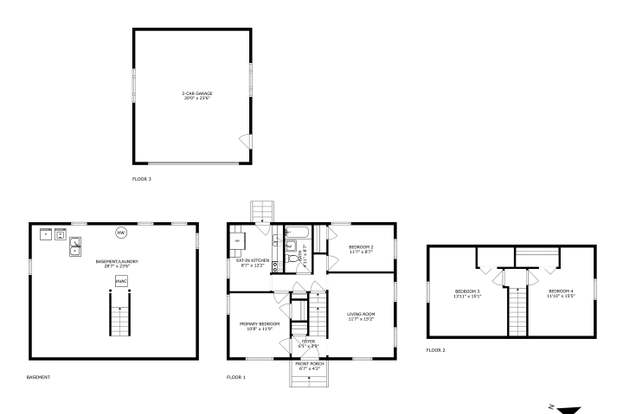
You are a GUI agent. You are given a task and a screenshot of the screen. Output one action in this format:
    pyautogui.click(x=<x>, y=<y>)
    Task: Click on the stairs
    
    Given the screenshot: What is the action you would take?
    pyautogui.click(x=519, y=325), pyautogui.click(x=307, y=366), pyautogui.click(x=316, y=325), pyautogui.click(x=124, y=325)